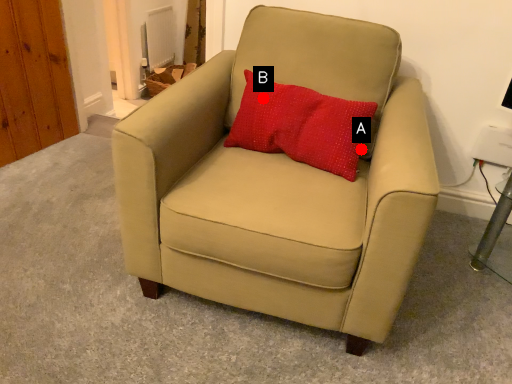
Question: Two points are circled on the image, labeled by A and B beside each circle. Which point is closer to the camera?

Choices:
 (A) A is closer
 (B) B is closer

Answer: (B)